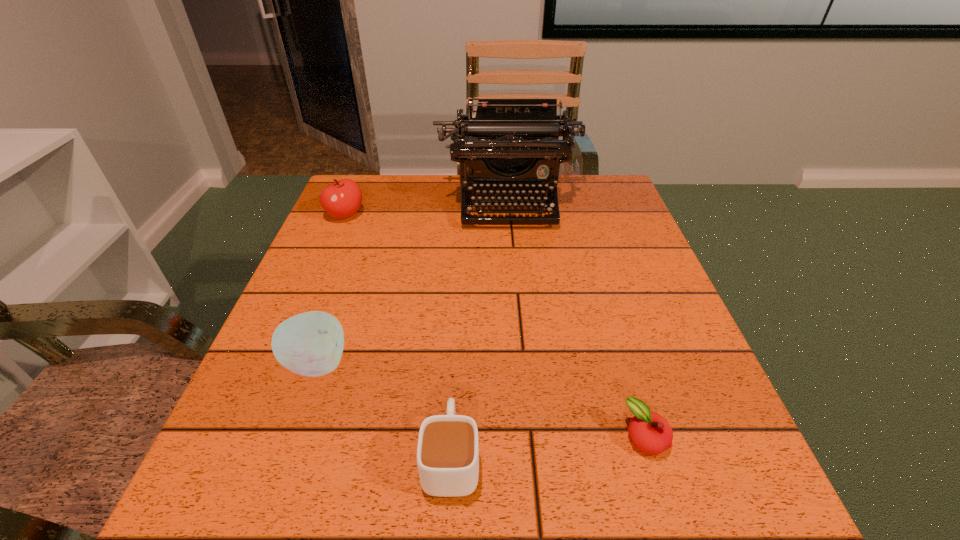
The image size is (960, 540). I want to click on vacant space at the far edge of the desktop, so click(408, 210).

Locate an element on the screen. This screenshot has width=960, height=540. free space at the near edge of the desktop is located at coordinates (596, 518).

The height and width of the screenshot is (540, 960). What are the coordinates of `vacant space at the left edge` in the screenshot? It's located at (294, 378).

In the image, there is a desktop. At what (x,y) coordinates should I click in order to perform the action: click on vacant space at the right edge. Please return your answer as a coordinate pair (x, y). This screenshot has width=960, height=540. Looking at the image, I should click on (617, 245).

Locate an element on the screen. Image resolution: width=960 pixels, height=540 pixels. free space at the near left corner is located at coordinates (265, 519).

In the image, there is a desktop. In order to click on vacant space at the far right corner in this screenshot , I will do `click(618, 218)`.

Where is `free space between the shortest object and the tallest object`? The image size is (960, 540). free space between the shortest object and the tallest object is located at coordinates (576, 319).

The width and height of the screenshot is (960, 540). In order to click on free space that is in between the typewriter and the third farthest object in this screenshot , I will do `click(412, 282)`.

Where is `vacant point located between the farthest apple and the second farthest apple`? vacant point located between the farthest apple and the second farthest apple is located at coordinates (331, 289).

You are a GUI agent. You are given a task and a screenshot of the screen. Output one action in this format:
    pyautogui.click(x=<x>, y=<y>)
    Task: Click on the free space between the shortest object and the farthest apple
    The image size is (960, 540).
    Given the screenshot: What is the action you would take?
    pyautogui.click(x=495, y=326)